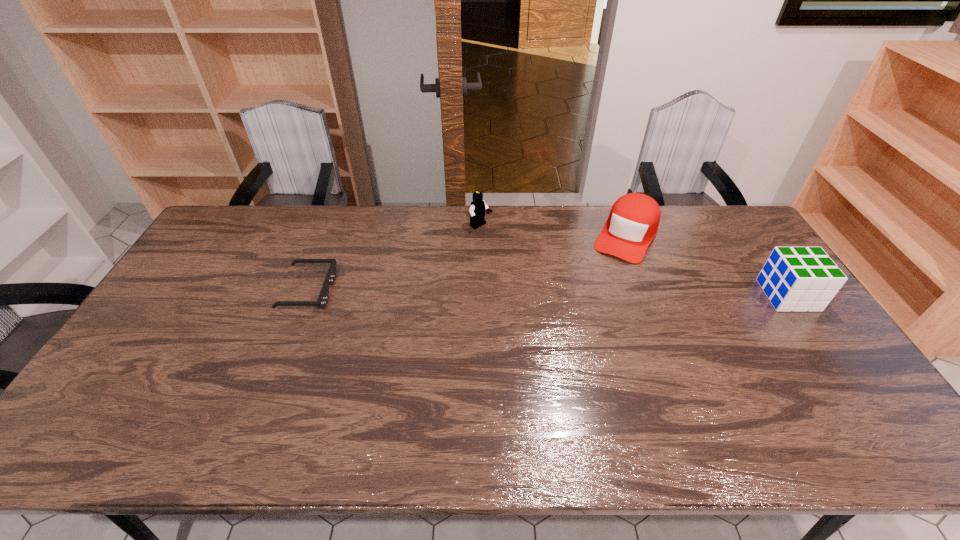
Where is `free space on the desktop that is between the sunglasses and the cube and is positioned on the front-facing side of the second object from right to left`? free space on the desktop that is between the sunglasses and the cube and is positioned on the front-facing side of the second object from right to left is located at coordinates (592, 293).

Where is `vacant space on the desktop that is between the leftmost object and the rightmost object and is positioned on the front-facing side of the third object from right to left`? vacant space on the desktop that is between the leftmost object and the rightmost object and is positioned on the front-facing side of the third object from right to left is located at coordinates (581, 293).